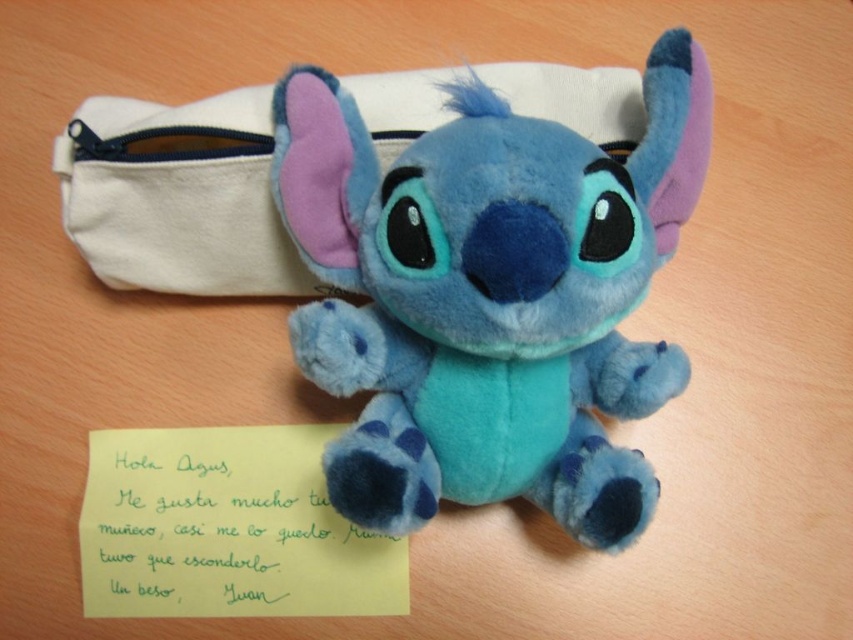
Consider the image. Who is more distant from viewer, (219, 160) or (234, 596)?

Positioned behind is point (234, 596).

Is white canvas pouch at upper center taller than yellow paper at center?

Yes.

Image resolution: width=853 pixels, height=640 pixels. What are the coordinates of `white canvas pouch at upper center` in the screenshot? It's located at (177, 195).

Is soft blue plush toy at center to the right of white canvas pouch at upper center from the viewer's perspective?

Correct, you'll find soft blue plush toy at center to the right of white canvas pouch at upper center.

Is point (471, 148) closer to camera compared to point (94, 220)?

Yes, it is.

Identify the location of soft blue plush toy at center. (489, 296).

Does soft blue plush toy at center have a greater height compared to yellow paper at center?

Yes, soft blue plush toy at center is taller than yellow paper at center.

Can you confirm if soft blue plush toy at center is positioned to the left of yellow paper at center?

Incorrect, soft blue plush toy at center is not on the left side of yellow paper at center.

What do you see at coordinates (489, 296) in the screenshot?
I see `soft blue plush toy at center` at bounding box center [489, 296].

Locate an element on the screen. The image size is (853, 640). soft blue plush toy at center is located at coordinates point(489,296).